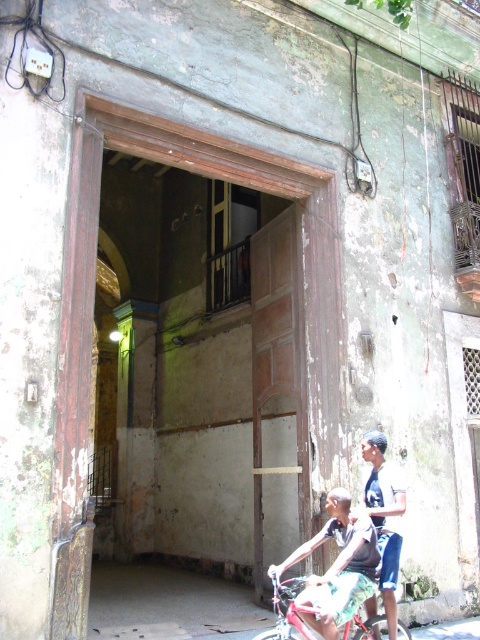
From the picture: You are a delivery person who needs to place a package on the dark blue jersey at center. The coordinates provided indicate its position relative to the image frame. If the image frame is 1000x1000 pixels, where would you place the package?

The dark blue jersey at center is located at point (384,516) of the image frame. Converting this to pixels, the coordinates would be approximately 809 pixels horizontally and 802 pixels vertically. Place the package at this position.

You are a delivery person standing outside the building and need to place a package on the dark blue jersey at center and the metallic red bicycle at center. Can you fit both items side by side on a 40 inch wide shelf?

The dark blue jersey at center and metallic red bicycle at center are 37.70 inches apart, so yes, they can fit side by side on a 40 inch wide shelf since the total width is less than 40 inches.

You are a delivery person who needs to enter the building through the doorway. However, there is a dark blue jersey at center and a metallic red bicycle at center blocking your path. Can you pass through the doorway without moving either object?

The dark blue jersey at center is larger in size than metallic red bicycle at center. Since the jersey is larger, it might block more of the doorway. However, without knowing the exact dimensions of the doorway or the objects, it is uncertain if you can pass through without moving them. You should check the clearance before attempting to enter.